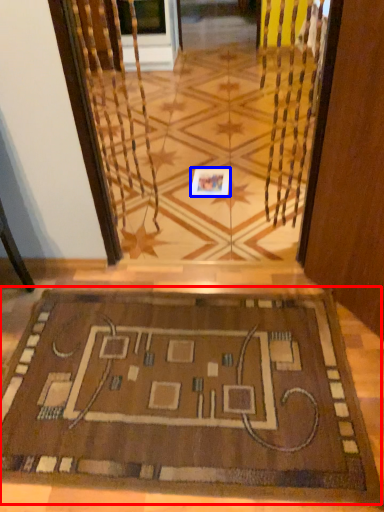
Question: Which of the following is the closest to the observer, mat (highlighted by a red box) or square (highlighted by a blue box)?

Choices:
 (A) mat
 (B) square

Answer: (A)